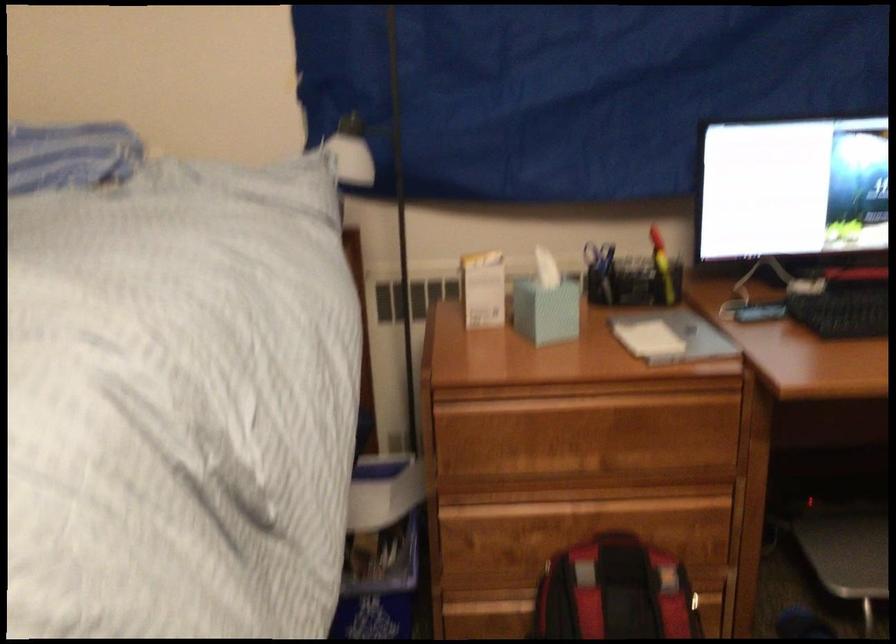
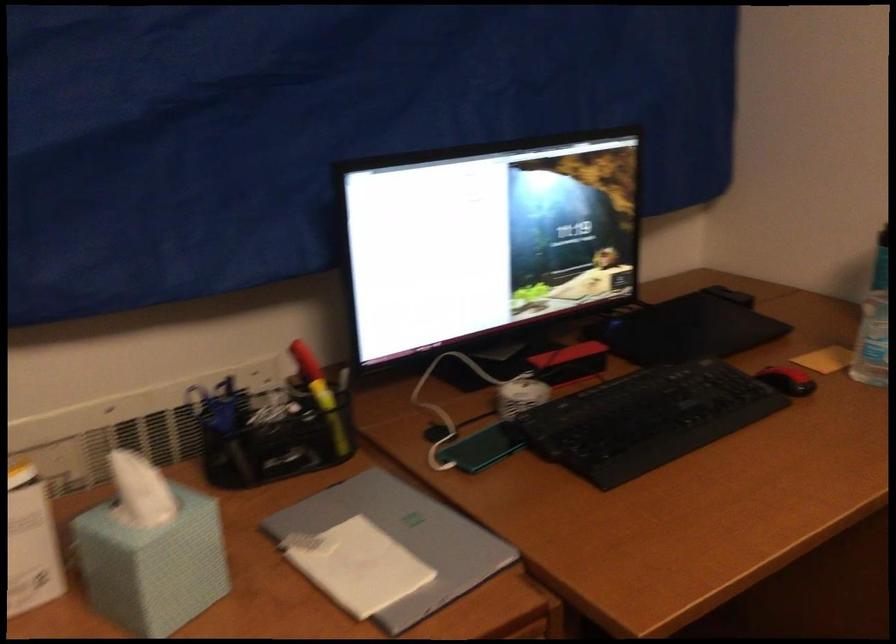
Find the pixel in the second image that matches point (540, 292) in the first image.

(150, 550)